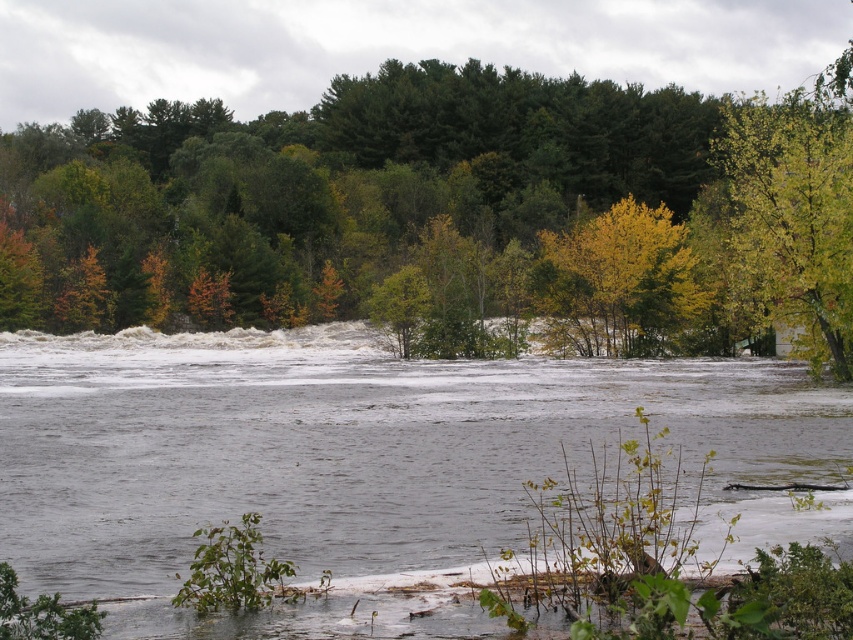
Question: Which point appears farthest from the camera in this image?

Choices:
 (A) (503, 369)
 (B) (799, 276)
 (C) (682, 177)
 (D) (566, 257)

Answer: (C)

Question: Is gray water at center below yellow leafy tree at center?

Choices:
 (A) yes
 (B) no

Answer: (A)

Question: Can you confirm if gray water at center is positioned to the left of yellow-green leaves at upper right?

Choices:
 (A) no
 (B) yes

Answer: (B)

Question: Which point is farther from the camera taking this photo?

Choices:
 (A) (381, 234)
 (B) (730, 147)

Answer: (A)

Question: Which object is the farthest from the yellow-green leaves at upper right?

Choices:
 (A) yellow leafy tree at center
 (B) gray water at center

Answer: (B)

Question: Is gray water at center to the left of yellow leafy tree at center from the viewer's perspective?

Choices:
 (A) no
 (B) yes

Answer: (B)